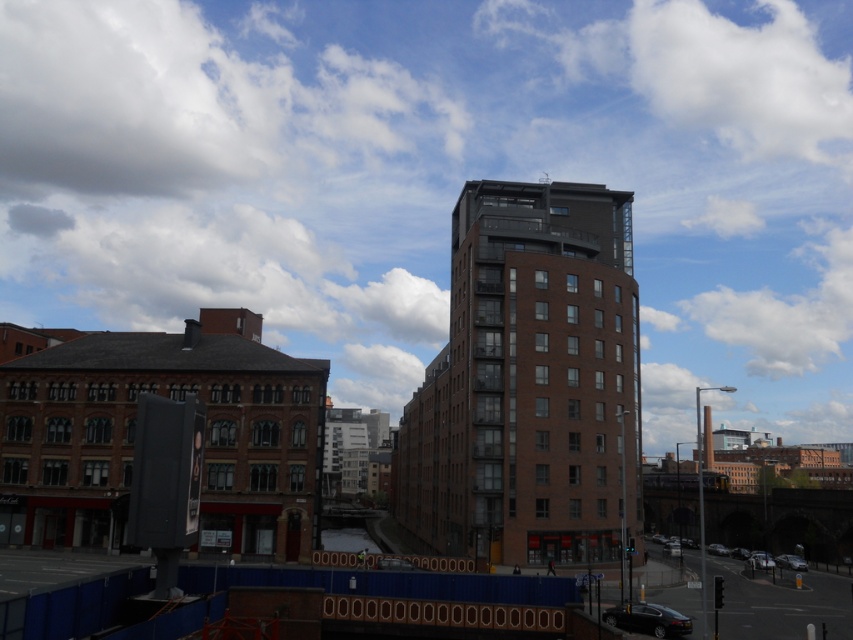
Question: Which point is farther to the camera?

Choices:
 (A) brown brick building at center
 (B) white fluffy cloud at upper center

Answer: (B)

Question: Is white fluffy cloud at upper center positioned in front of brown brick building at center?

Choices:
 (A) no
 (B) yes

Answer: (A)

Question: Does white fluffy cloud at upper center have a greater width compared to brown brick building at center?

Choices:
 (A) no
 (B) yes

Answer: (B)

Question: Observing the image, what is the correct spatial positioning of white fluffy cloud at upper center in reference to brown brick building at center?

Choices:
 (A) above
 (B) below

Answer: (A)

Question: Which of the following is the farthest from the observer?

Choices:
 (A) coord(573,296)
 (B) coord(416,268)

Answer: (B)